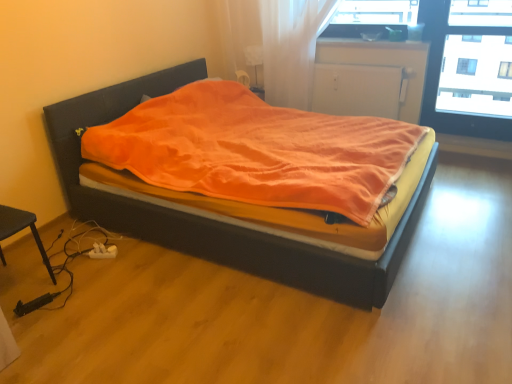
The image size is (512, 384). What are the coordinates of `free space above white matte radiator at upper center (from a real-world perspective)` in the screenshot? It's located at (361, 63).